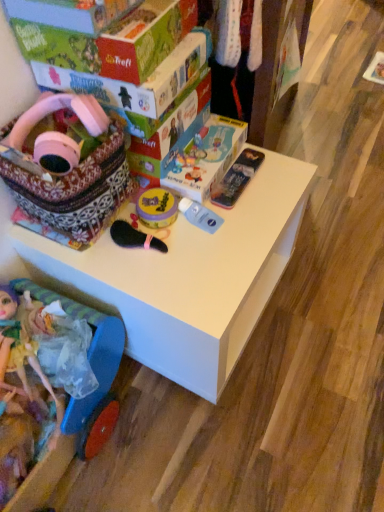
Where is `free space in front of transparent plastic bottle at center, which is the second toy from right to left`? Image resolution: width=384 pixels, height=512 pixels. free space in front of transparent plastic bottle at center, which is the second toy from right to left is located at coordinates (206, 272).